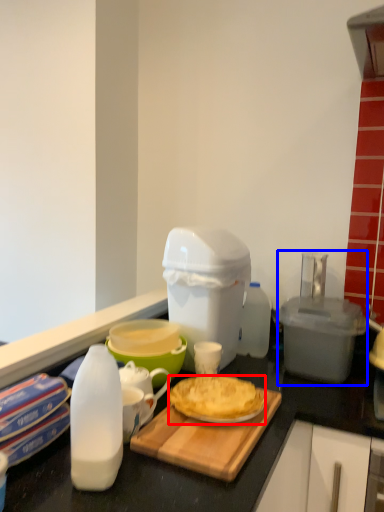
Question: Which object is further to the camera taking this photo, dessert (highlighted by a red box) or appliance (highlighted by a blue box)?

Choices:
 (A) dessert
 (B) appliance

Answer: (B)